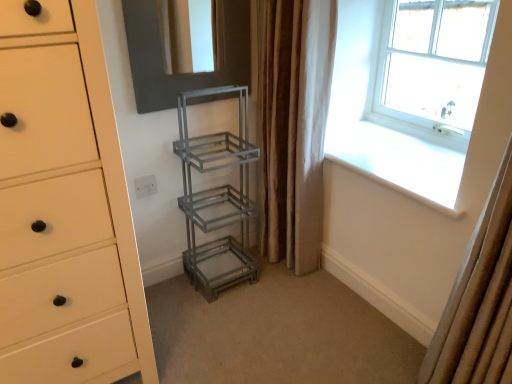
Where is `free space in front of brown textured curtain at right, which appears as the 1th curtain when viewed from the back`? This screenshot has width=512, height=384. free space in front of brown textured curtain at right, which appears as the 1th curtain when viewed from the back is located at coordinates (298, 299).